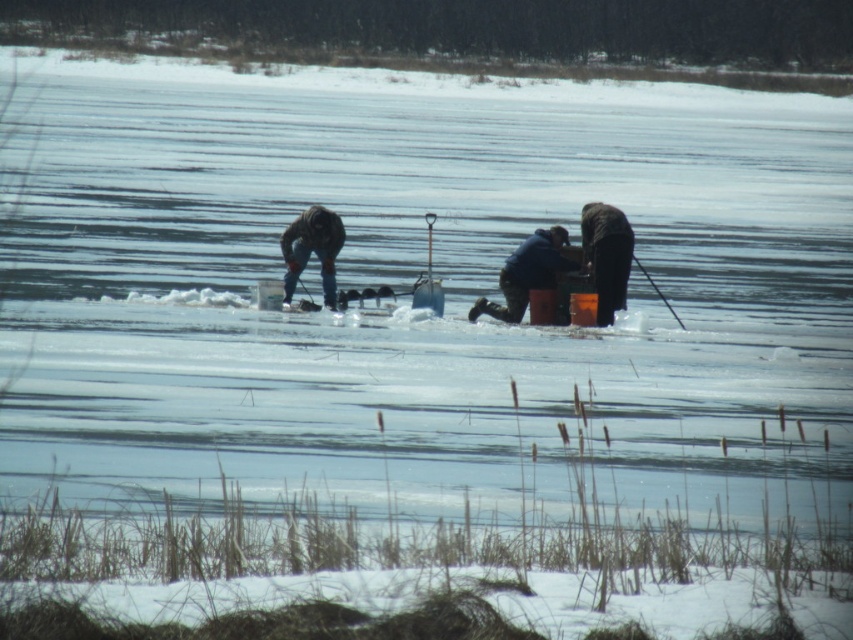
You are a photographer trying to capture a group photo of the two people wearing the blue fabric jacket at center and the black matte jacket at center. Since you want to ensure both are clearly visible, which jacket will appear bigger in the photo?

The blue fabric jacket at center will appear bigger in the photo because it is larger in size than the black matte jacket at center.

You are a photographer trying to capture a group photo of the two people wearing the blue fabric jacket at center and black matte jacket at center. Since you want both jackets to appear the same size in the photo, which jacket should you position closer to the camera?

The blue fabric jacket at center is shorter than the black matte jacket at center. To make them appear the same size in the photo, position the shorter blue fabric jacket at center closer to the camera and the taller black matte jacket at center further back.